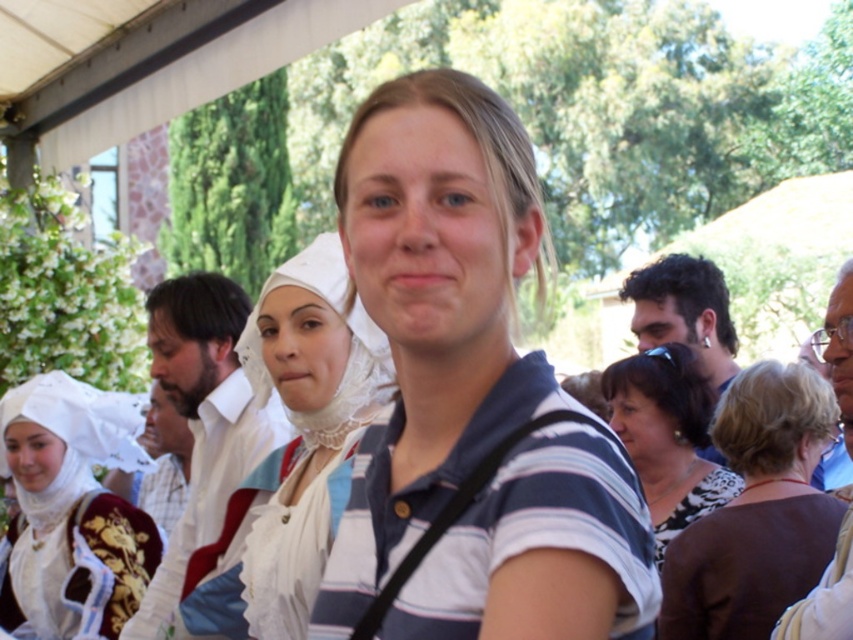
Question: Is white lace headdress at upper left below blue striped shirt at center?

Choices:
 (A) no
 (B) yes

Answer: (B)

Question: Which object appears closest to the camera in this image?

Choices:
 (A) brown fabric at center
 (B) white fabric shirt at center
 (C) matte white blouse at center

Answer: (B)

Question: Which object is farther from the camera taking this photo?

Choices:
 (A) white fabric shirt at center
 (B) matte white blouse at center
 (C) white lace headdress at center
 (D) dark brown hair at right

Answer: (D)

Question: Considering the real-world distances, which object is farthest from the white lace headdress at upper left?

Choices:
 (A) dark brown hair at right
 (B) brown fabric at center
 (C) blue striped shirt at center

Answer: (C)

Question: Does white lace headdress at upper left have a smaller size compared to matte white blouse at center?

Choices:
 (A) no
 (B) yes

Answer: (A)

Question: Is the position of white lace headdress at center less distant than that of brown fabric at center?

Choices:
 (A) yes
 (B) no

Answer: (A)